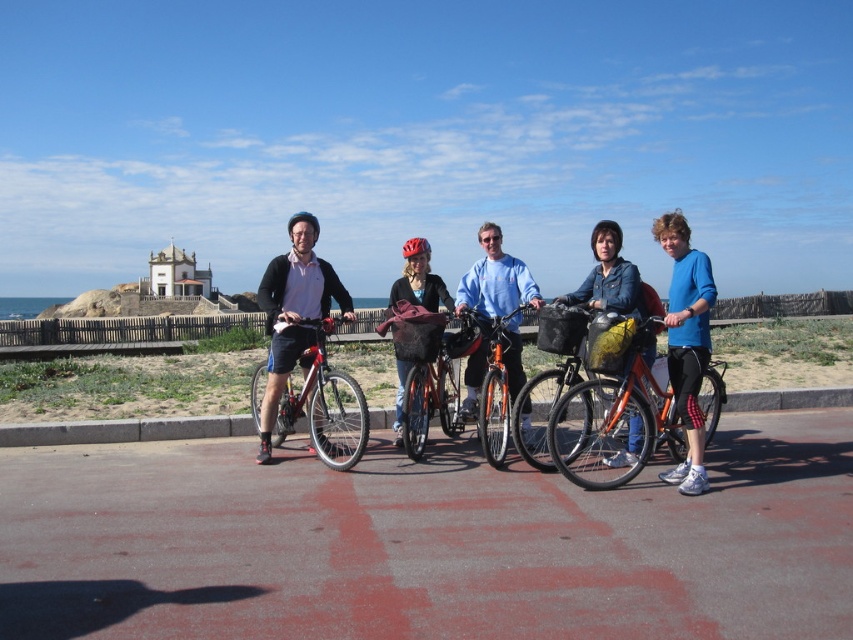
You are a photographer standing on the pathway and want to take a photo of the shiny metallic bicycle at left and the orange metallic bicycle at center. Which bicycle should you focus on first if you want to capture both in the frame without moving your camera?

The shiny metallic bicycle at left is positioned on the left side of the orange metallic bicycle at center, so you should focus on the shiny metallic bicycle at left first to ensure both bicycles are included in the frame without moving the camera.

You are planning to carry a large picnic basket and need to choose between the orange metallic bicycle at center and the shiny red bicycle at center. Which bicycle can accommodate the basket more comfortably?

The shiny red bicycle at center has a larger size compared to the orange metallic bicycle at center, so it can accommodate the large picnic basket more comfortably.